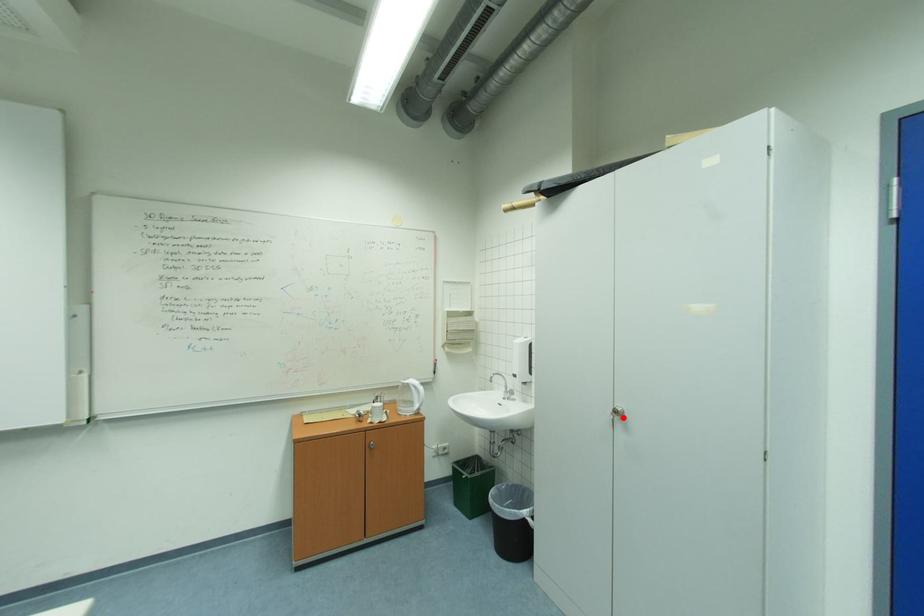
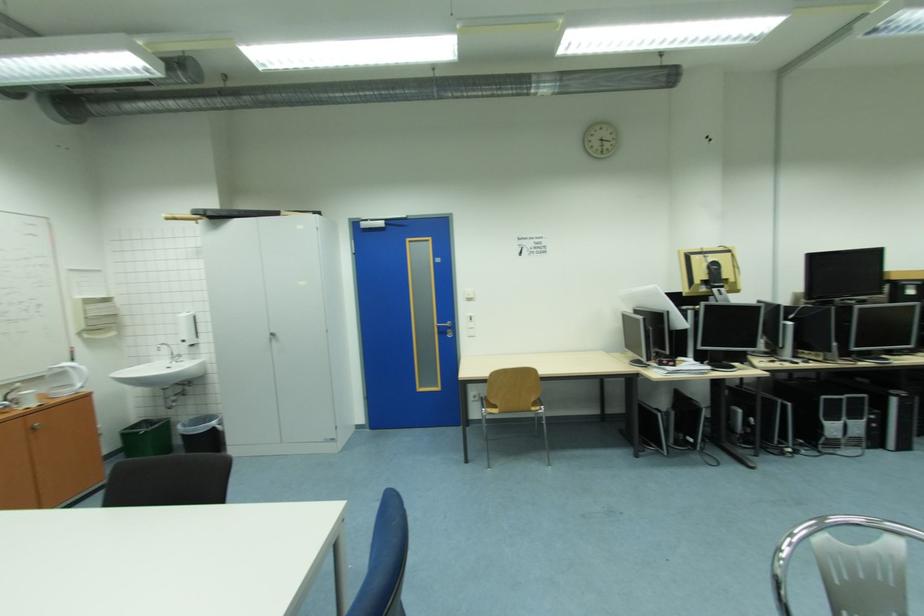
Find the pixel in the second image that matches the highlighted location in the first image.

(278, 338)